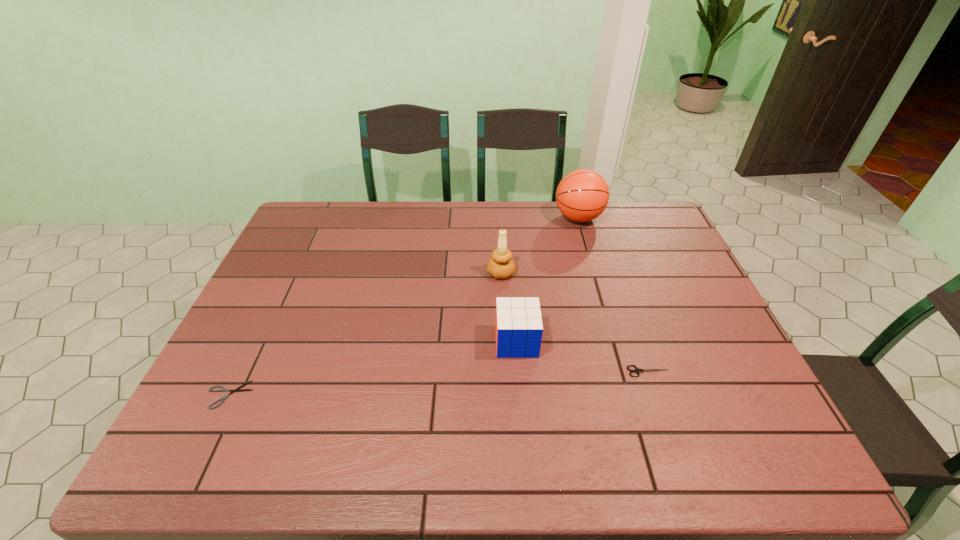
Where is `vacant space that's between the farthest object and the candle_holder`? This screenshot has width=960, height=540. vacant space that's between the farthest object and the candle_holder is located at coordinates (540, 246).

Find the location of a particular element. Image resolution: width=960 pixels, height=540 pixels. the closest object to the nearer shears is located at coordinates (519, 329).

Where is `object identified as the closest to the shortest object`? object identified as the closest to the shortest object is located at coordinates (519, 329).

At what (x,y) coordinates should I click in order to perform the action: click on free space that satisfies the following two spatial constraints: 1. on the back side of the left shears; 2. on the left side of the third nearest object. Please return your answer as a coordinate pair (x, y). The image size is (960, 540). Looking at the image, I should click on (255, 341).

Locate an element on the screen. The width and height of the screenshot is (960, 540). free point that satisfies the following two spatial constraints: 1. on the back side of the left shears; 2. on the right side of the right shears is located at coordinates (241, 372).

The height and width of the screenshot is (540, 960). Find the location of `vacant area in the image that satisfies the following two spatial constraints: 1. on the back side of the basketball; 2. on the right side of the fourth nearest object`. vacant area in the image that satisfies the following two spatial constraints: 1. on the back side of the basketball; 2. on the right side of the fourth nearest object is located at coordinates (498, 218).